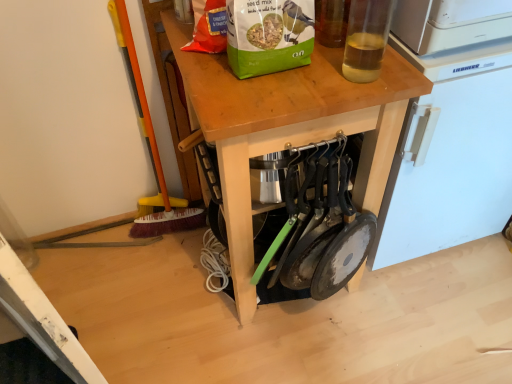
At what (x,y) coordinates should I click in order to perform the action: click on free spot in front of orange plastic brush at left. Please return your answer as a coordinate pair (x, y). Looking at the image, I should click on (157, 256).